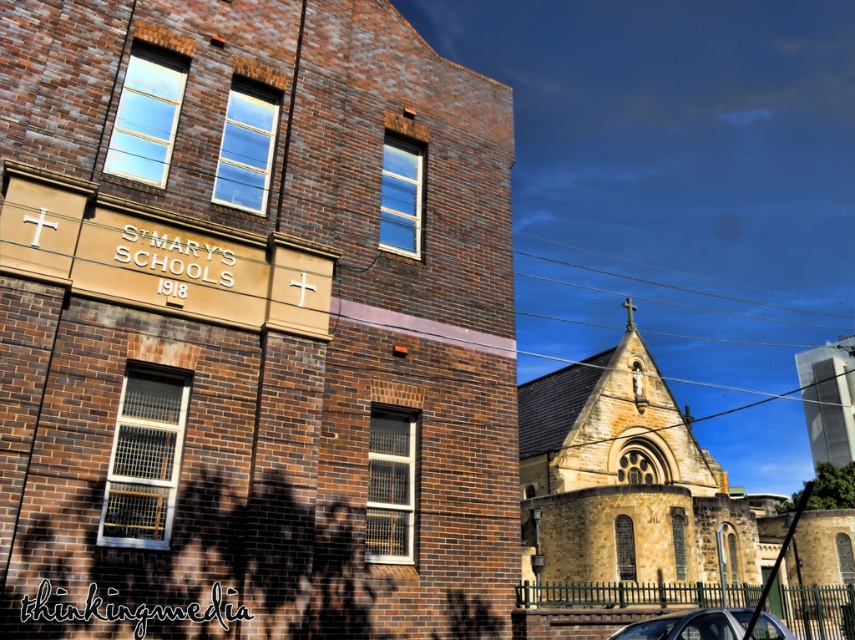
Can you confirm if brown stone church at center is bigger than metallic silver car at lower right?

Yes, brown stone church at center is bigger than metallic silver car at lower right.

Who is higher up, brown stone church at center or metallic silver car at lower right?

brown stone church at center is above.

Which is behind, point (27, 118) or point (723, 634)?

Positioned behind is point (27, 118).

Where is `brown stone church at center`? This screenshot has height=640, width=855. brown stone church at center is located at coordinates (252, 324).

Is brown stone church at center taller than yellow stone church at center?

No, brown stone church at center is not taller than yellow stone church at center.

Who is shorter, brown stone church at center or yellow stone church at center?

brown stone church at center is shorter.

This screenshot has height=640, width=855. What do you see at coordinates (252, 324) in the screenshot? I see `brown stone church at center` at bounding box center [252, 324].

I want to click on brown stone church at center, so click(252, 324).

Is yellow stone church at center below metallic silver car at lower right?

Yes.

Consider the image. Does yellow stone church at center have a larger size compared to metallic silver car at lower right?

Yes, yellow stone church at center is bigger than metallic silver car at lower right.

Does point (634, 378) lie behind point (670, 618)?

That is True.

Locate an element on the screen. This screenshot has height=640, width=855. yellow stone church at center is located at coordinates (623, 477).